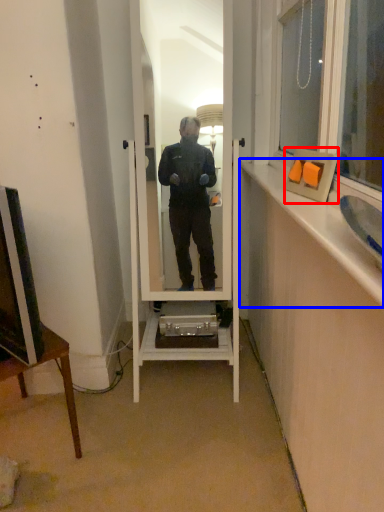
Question: Which of the following is the closest to the observer, picture frame (highlighted by a red box) or window sill (highlighted by a blue box)?

Choices:
 (A) picture frame
 (B) window sill

Answer: (B)